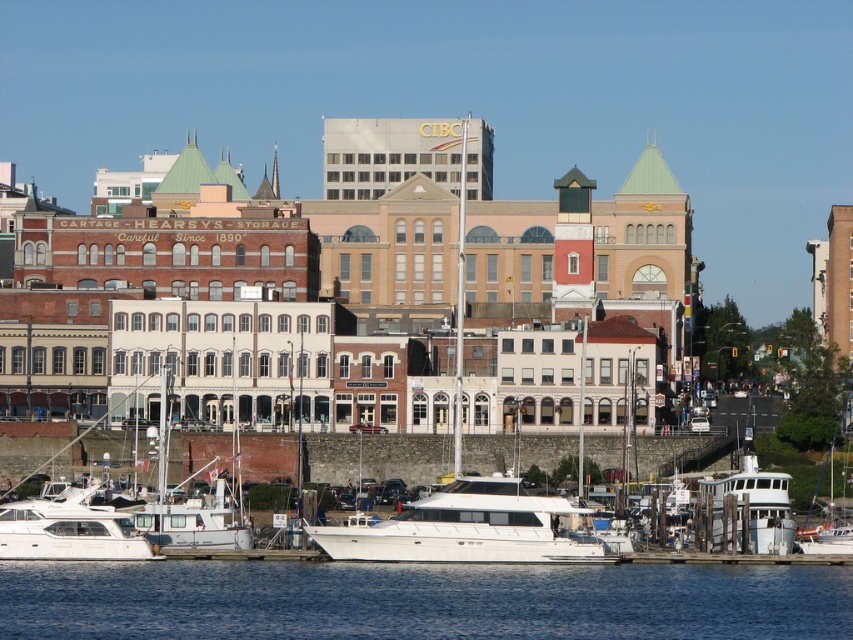
Question: Which point is closer to the camera?

Choices:
 (A) white glossy boat at center
 (B) white glossy boat at lower right

Answer: (A)

Question: In this image, where is white glossy yacht at center located relative to white glossy boat at lower right?

Choices:
 (A) below
 (B) above

Answer: (A)

Question: Which point is closer to the camera taking this photo?

Choices:
 (A) (445, 520)
 (B) (518, 589)
 (C) (746, 547)

Answer: (B)

Question: Which point appears farthest from the camera in this image?

Choices:
 (A) (123, 560)
 (B) (712, 484)
 (C) (496, 595)

Answer: (B)

Question: Considering the relative positions of blue water at lower center and white glossy yacht at center in the image provided, where is blue water at lower center located with respect to white glossy yacht at center?

Choices:
 (A) above
 (B) below

Answer: (B)

Question: Is blue water at lower center below white glossy yacht at center?

Choices:
 (A) no
 (B) yes

Answer: (B)